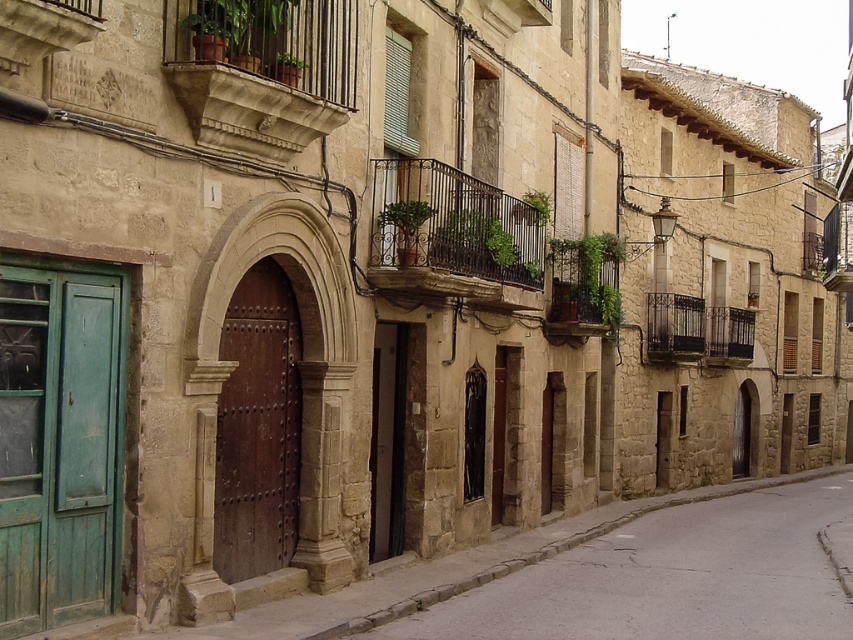
In the scene shown: You are a tourist standing in front of the brown polished wood door at center and the black wrought iron balcony at upper right. Which object is positioned higher in the scene?

The black wrought iron balcony at upper right is positioned higher than the brown polished wood door at center because the brown polished wood door at center is located below it.

You are standing on the street and see two points marked in the image. The first point is at coordinates point [796,582] and the second is at point [576,294]. Which point is closer to you?

Point [796,582] is in front of point [576,294], so it is closer to you.

You are a tourist standing in front of the historic building. You want to take a photo of the green matte door at left and the stone textured balcony at upper left. Which object should you focus on first if you want to capture both in a single frame without moving the camera?

The green matte door at left is below the stone textured balcony at upper left, so you should focus on the green matte door at left first to ensure both are in the frame.